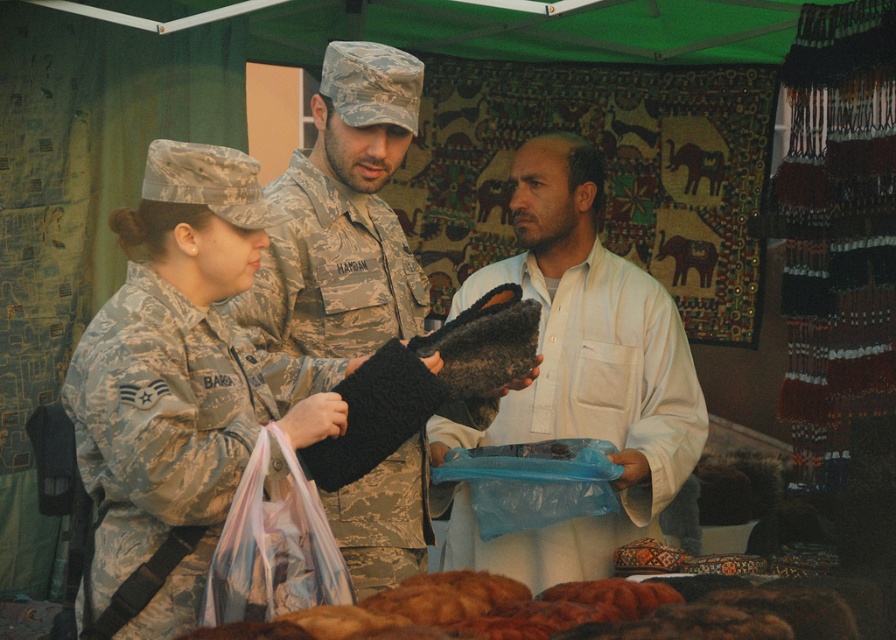
Which is behind, point (472, 547) or point (493, 580)?

The point (472, 547) is more distant.

How much distance is there between white cotton shirt at center and fuzzy brown bread at lower center?

white cotton shirt at center and fuzzy brown bread at lower center are 1.38 meters apart from each other.

This screenshot has width=896, height=640. What do you see at coordinates (580, 372) in the screenshot?
I see `white cotton shirt at center` at bounding box center [580, 372].

Locate an element on the screen. The width and height of the screenshot is (896, 640). white cotton shirt at center is located at coordinates (580, 372).

Can you confirm if camouflage fabric uniform at center is positioned below fuzzy brown bread at lower center?

Actually, camouflage fabric uniform at center is above fuzzy brown bread at lower center.

Can you confirm if camouflage fabric uniform at center is shorter than fuzzy brown bread at lower center?

No.

Identify the location of camouflage fabric uniform at center. The width and height of the screenshot is (896, 640). (160, 440).

Is white cotton shirt at center thinner than dark brown fuzzy slippers at center?

In fact, white cotton shirt at center might be wider than dark brown fuzzy slippers at center.

Is white cotton shirt at center positioned behind dark brown fuzzy slippers at center?

Answer: Yes, it is.

Between point (556, 308) and point (291, 220), which one is positioned behind?

The point (556, 308) is more distant.

Where is `white cotton shirt at center`? Image resolution: width=896 pixels, height=640 pixels. white cotton shirt at center is located at coordinates (580, 372).